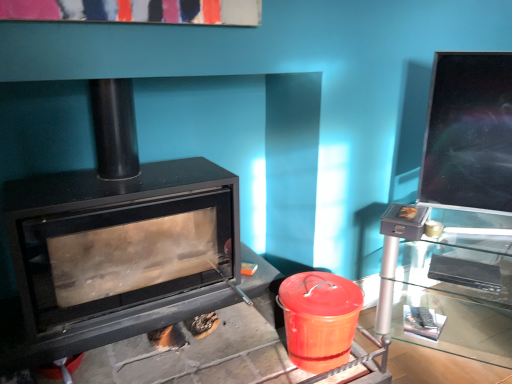
Question: Is black matte wood burning stove at left facing towards glossy ceramic crock pot at lower right?

Choices:
 (A) yes
 (B) no

Answer: (A)

Question: From the image's perspective, is black matte wood burning stove at left under glossy ceramic crock pot at lower right?

Choices:
 (A) yes
 (B) no

Answer: (B)

Question: Does black matte wood burning stove at left have a lesser height compared to glossy ceramic crock pot at lower right?

Choices:
 (A) no
 (B) yes

Answer: (A)

Question: Is black matte wood burning stove at left smaller than glossy ceramic crock pot at lower right?

Choices:
 (A) yes
 (B) no

Answer: (B)

Question: Is black matte wood burning stove at left behind glossy ceramic crock pot at lower right?

Choices:
 (A) yes
 (B) no

Answer: (B)

Question: Is glossy ceramic crock pot at lower right at the back of black matte wood burning stove at left?

Choices:
 (A) yes
 (B) no

Answer: (B)

Question: Is transparent glass table at right thinner than black matte wood burning stove at left?

Choices:
 (A) yes
 (B) no

Answer: (A)

Question: Considering the relative positions of transparent glass table at right and black matte wood burning stove at left in the image provided, is transparent glass table at right behind black matte wood burning stove at left?

Choices:
 (A) no
 (B) yes

Answer: (B)

Question: Is transparent glass table at right to the right of black matte wood burning stove at left from the viewer's perspective?

Choices:
 (A) yes
 (B) no

Answer: (A)

Question: Does transparent glass table at right lie in front of black matte wood burning stove at left?

Choices:
 (A) no
 (B) yes

Answer: (A)

Question: Is transparent glass table at right outside of black matte wood burning stove at left?

Choices:
 (A) yes
 (B) no

Answer: (A)

Question: From the image's perspective, is transparent glass table at right on top of black matte wood burning stove at left?

Choices:
 (A) no
 (B) yes

Answer: (A)

Question: Considering the relative sizes of glossy ceramic crock pot at lower right and transparent glass table at right in the image provided, is glossy ceramic crock pot at lower right taller than transparent glass table at right?

Choices:
 (A) no
 (B) yes

Answer: (A)